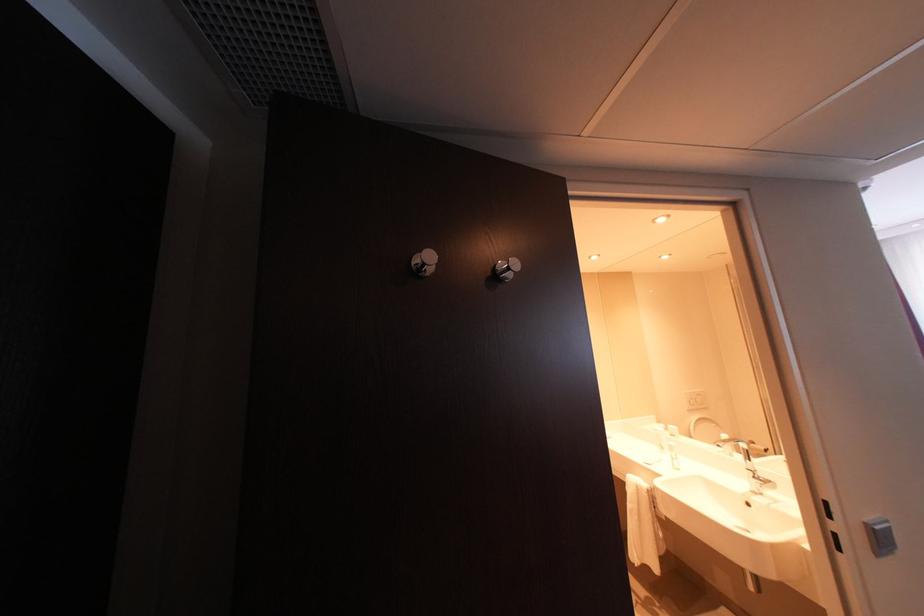
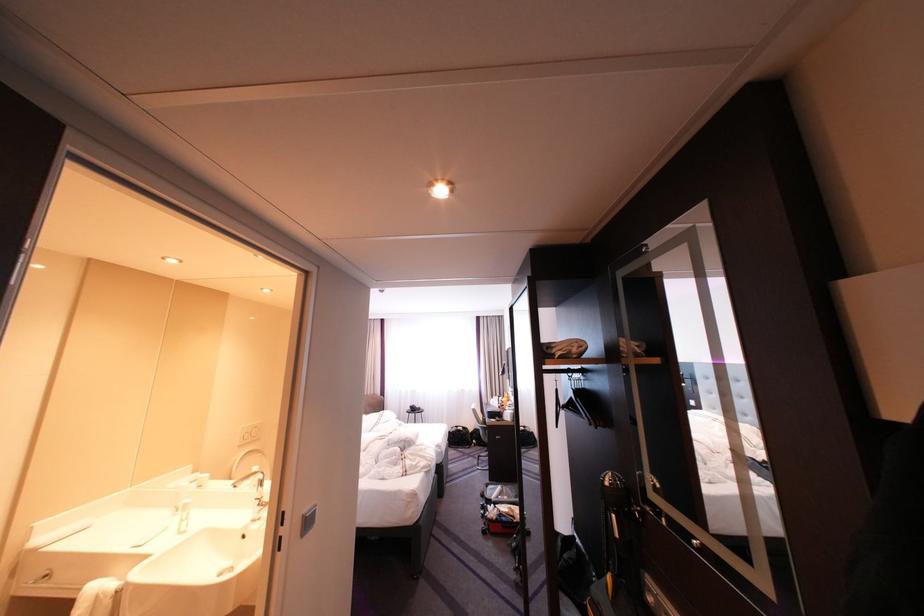
The point at [697,394] is marked in the first image. Where is the corresponding point in the second image?

(254, 429)